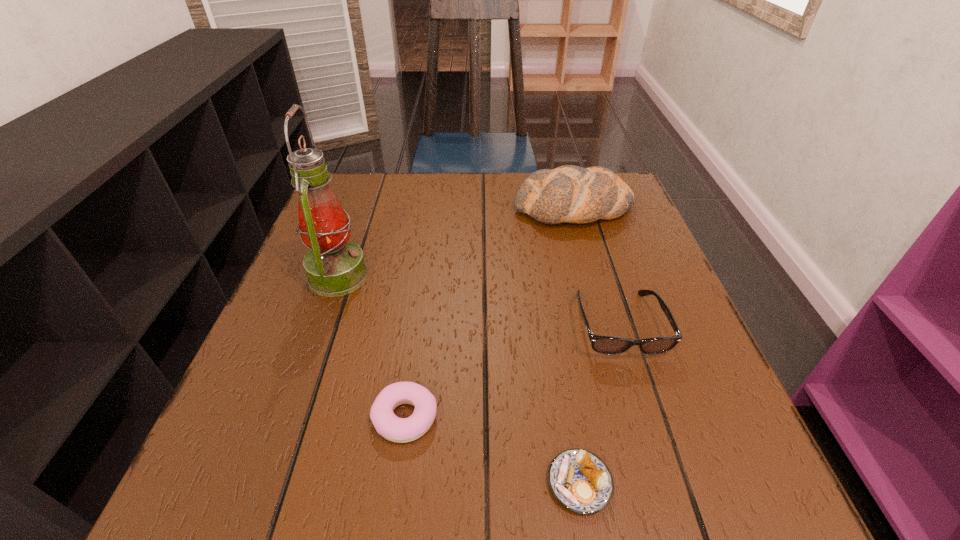
In order to click on vacant space at the far edge of the desktop in this screenshot , I will do `click(514, 212)`.

The image size is (960, 540). Identify the location of free space at the near edge. (396, 478).

Find the location of a particular element. Image resolution: width=960 pixels, height=540 pixels. free region at the left edge of the desktop is located at coordinates (332, 314).

At what (x,y) coordinates should I click in order to perform the action: click on free space at the right edge of the desktop. Please return your answer as a coordinate pair (x, y). Looking at the image, I should click on (634, 258).

In the image, there is a desktop. Identify the location of vacant area at the far left corner. (350, 200).

Find the location of a particular element. This screenshot has height=540, width=960. blank space at the near left corner is located at coordinates (174, 521).

Where is `free space between the fourth tallest object and the tallest object`? free space between the fourth tallest object and the tallest object is located at coordinates (372, 347).

Image resolution: width=960 pixels, height=540 pixels. What are the coordinates of `empty space that is in between the bread and the fourth tallest object` in the screenshot? It's located at (490, 313).

This screenshot has height=540, width=960. I want to click on vacant space that is in between the third tallest object and the second nearest object, so click(x=512, y=371).

Find the location of a particular element. Image resolution: width=960 pixels, height=540 pixels. free spot between the farthest object and the second nearest object is located at coordinates (490, 313).